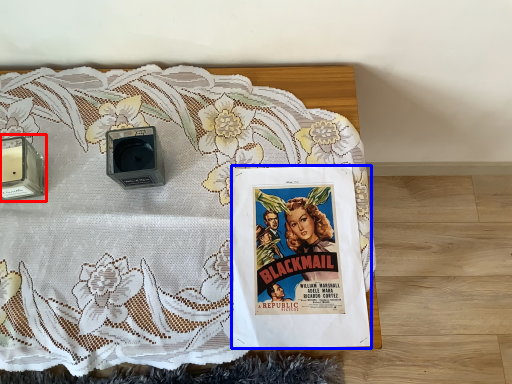
Question: Which object is closer to the camera taking this photo, speaker (highlighted by a red box) or comic book (highlighted by a blue box)?

Choices:
 (A) speaker
 (B) comic book

Answer: (B)